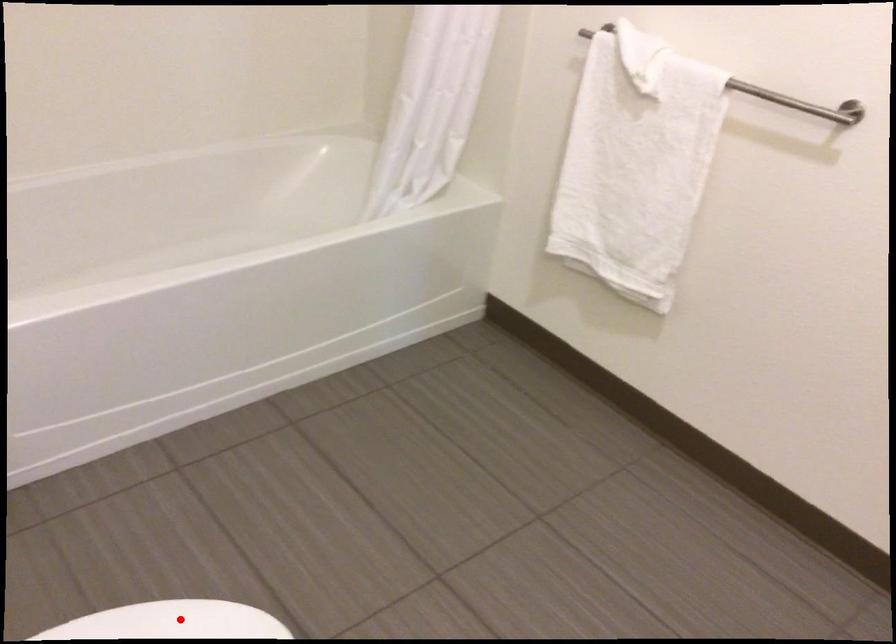
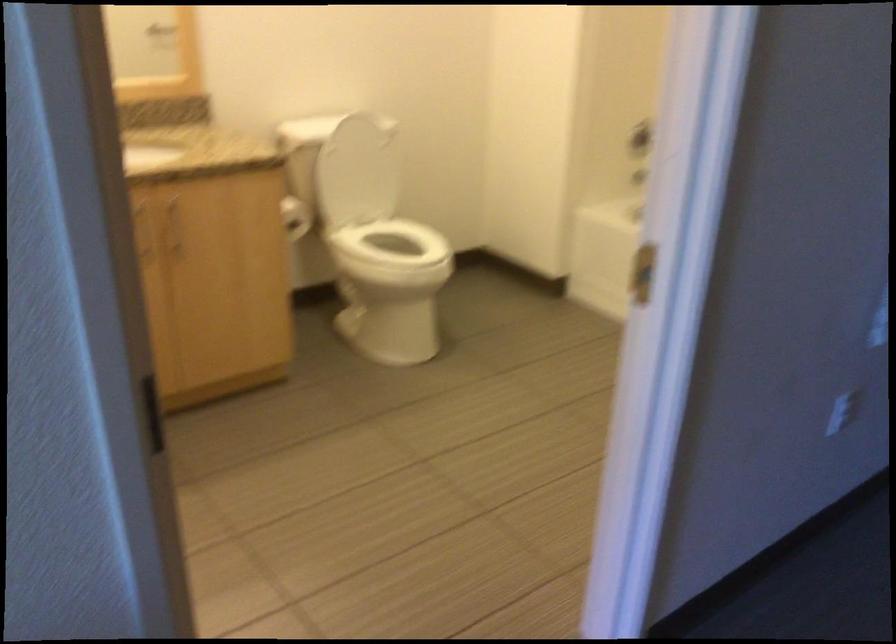
Question: I am providing you with two images of the same scene from different viewpoints. A red point is marked on the first image. Is the red point's position out of view in image 2?

Choices:
 (A) Yes
 (B) No

Answer: (A)